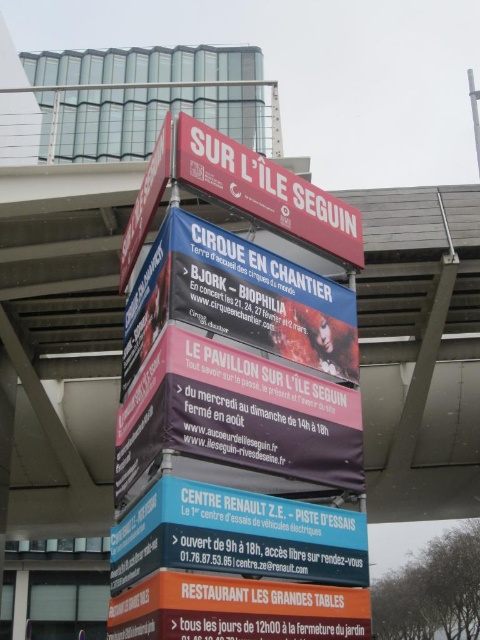
From the picture: You are a pedestrian looking at the multi tiered signboard. You see the orange matte signboard at lower center and the white plastic sign at upper center. Which one is taller?

The white plastic sign at upper center is taller than the orange matte signboard at lower center.

You are standing in front of a tall multi tiered signboard and see a point at coordinates (237, 609). What object is located at that point?

The point at coordinates (237, 609) corresponds to the orange matte signboard at lower center.